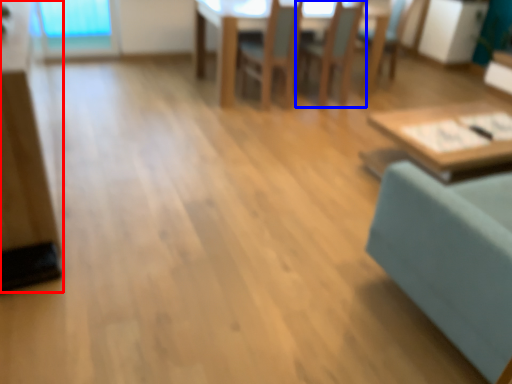
Question: Which point is further to the camera, dresser (highlighted by a red box) or chair (highlighted by a blue box)?

Choices:
 (A) dresser
 (B) chair

Answer: (B)